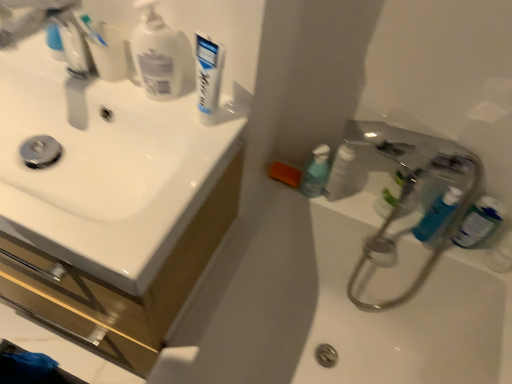
Locate an element on the screen. The height and width of the screenshot is (384, 512). vacant region to the left of green translucent bottle at upper right, the second mouthwash positioned from the left is located at coordinates (354, 201).